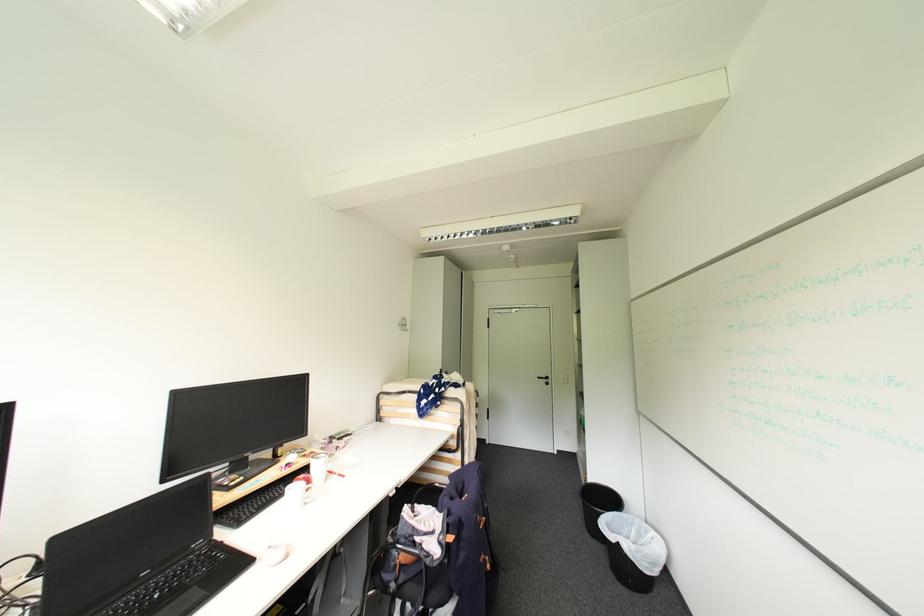
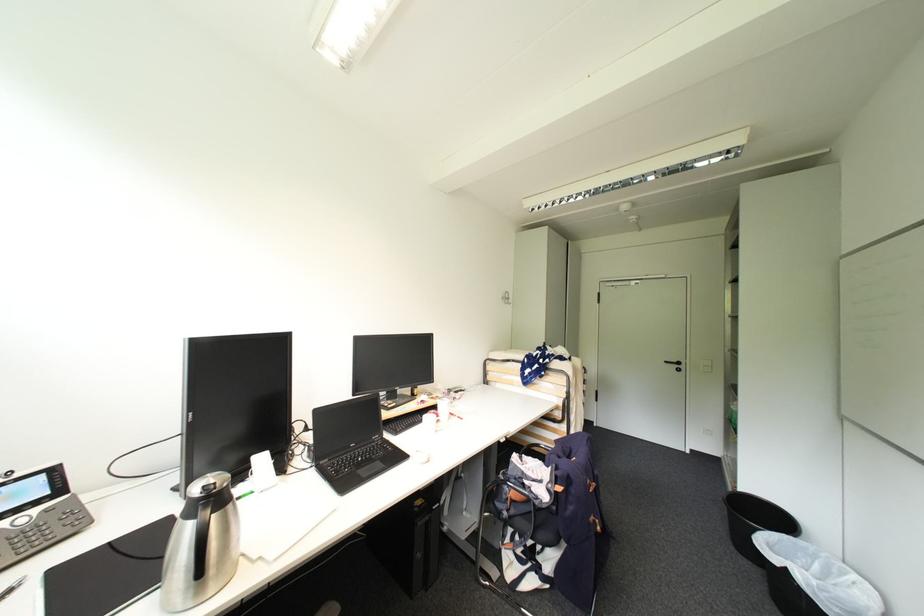
Locate, in the second image, the point that corresponds to the point at 286,495 in the first image.

(424, 421)